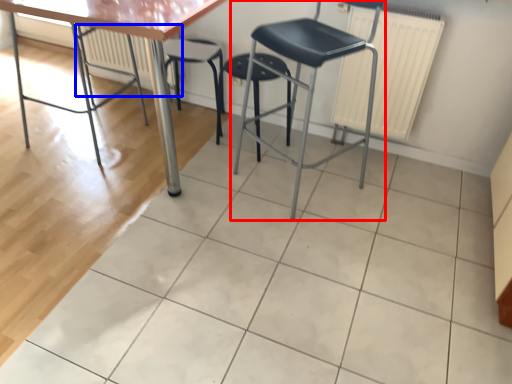
Question: Which object appears farthest to the camera in this image, chair (highlighted by a red box) or radiator (highlighted by a blue box)?

Choices:
 (A) chair
 (B) radiator

Answer: (B)